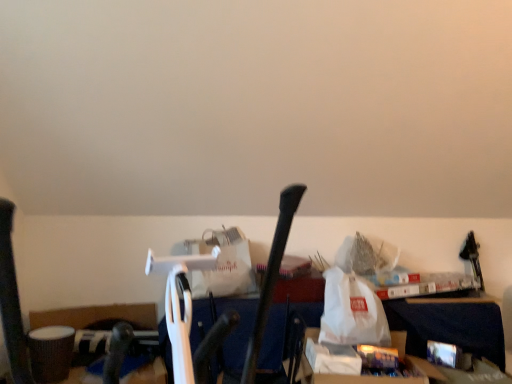
Describe the element at coordinates (353, 298) in the screenshot. This screenshot has width=512, height=384. I see `white plastic bag at center` at that location.

What is the approximate width of white plastic bag at center?

white plastic bag at center is 29.90 centimeters in width.

Where is `white plastic bag at center`? This screenshot has height=384, width=512. white plastic bag at center is located at coordinates (353, 298).

At what (x,y) coordinates should I click in order to perform the action: click on white plastic bag at center. Please return your answer as a coordinate pair (x, y). The image size is (512, 384). Looking at the image, I should click on (353, 298).